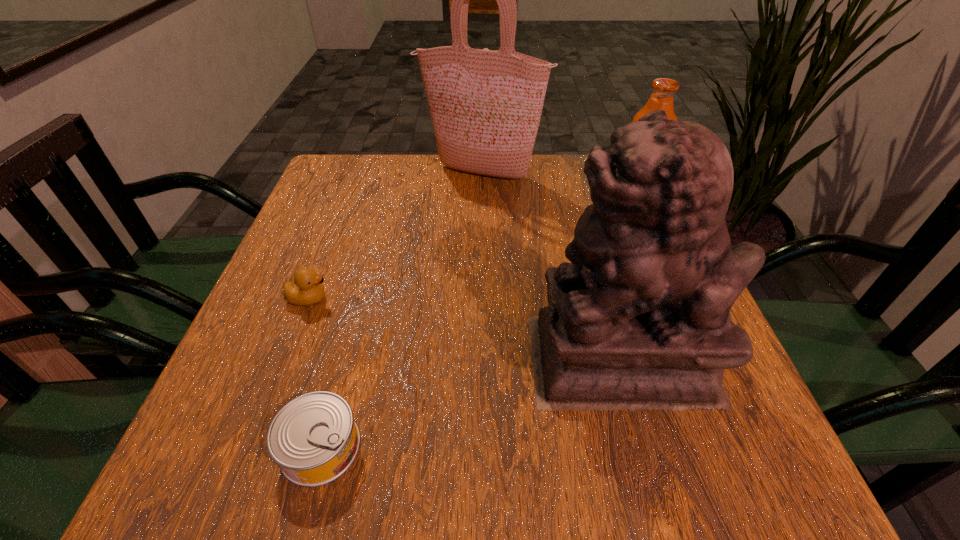
Find the location of `free region located 0.150m on the front-facing side of the sculpture`. free region located 0.150m on the front-facing side of the sculpture is located at coordinates (442, 360).

Locate an element on the screen. This screenshot has height=540, width=960. vacant space located 0.340m on the front-facing side of the sculpture is located at coordinates (328, 360).

You are a GUI agent. You are given a task and a screenshot of the screen. Output one action in this format:
    pyautogui.click(x=<x>, y=<y>)
    Task: Click on the vacant space located 0.150m on the label side of the fruit juice
    This screenshot has height=540, width=960.
    Given the screenshot: What is the action you would take?
    click(551, 202)

Find the location of a particular element. Image resolution: width=960 pixels, height=540 pixels. free space located on the label side of the fruit juice is located at coordinates coord(501,202).

This screenshot has width=960, height=540. I want to click on free point located 0.200m on the label side of the fruit juice, so click(x=530, y=202).

The width and height of the screenshot is (960, 540). I want to click on vacant region located 0.390m on the face of the third farthest object, so click(x=535, y=299).

This screenshot has width=960, height=540. Find the location of `vacant area situated on the left of the can`. vacant area situated on the left of the can is located at coordinates (246, 447).

This screenshot has width=960, height=540. Find the location of `shopping bag located at the far edge`. shopping bag located at the far edge is located at coordinates (485, 105).

Image resolution: width=960 pixels, height=540 pixels. I want to click on fruit juice at the far edge, so click(663, 89).

Where is `object present at the near edge`? This screenshot has height=540, width=960. object present at the near edge is located at coordinates (314, 439).